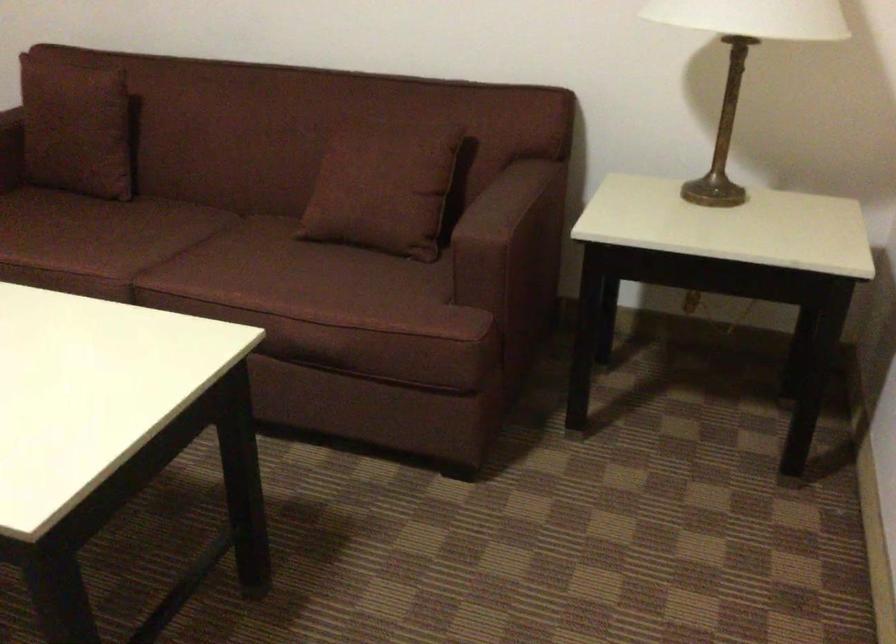
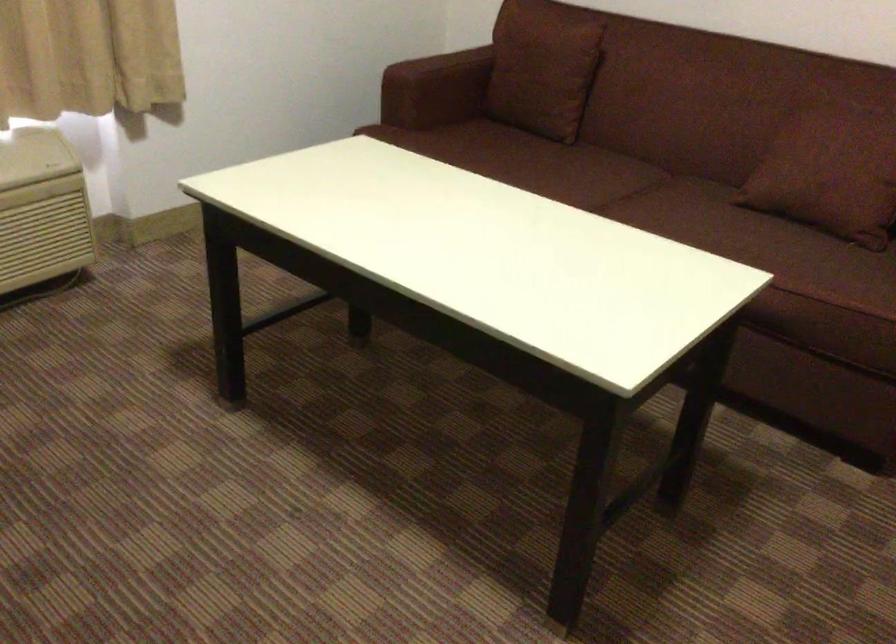
Question: The first image is from the beginning of the video and the second image is from the end. How did the camera likely rotate when shooting the video?

Choices:
 (A) Left
 (B) Right
 (C) Up
 (D) Down

Answer: (A)